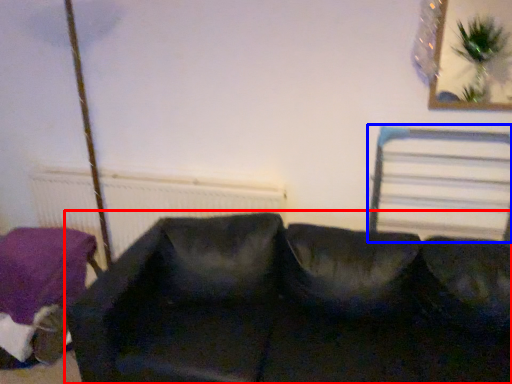
Question: Which object appears closest to the camera in this image, studio couch (highlighted by a red box) or bed frame (highlighted by a blue box)?

Choices:
 (A) studio couch
 (B) bed frame

Answer: (A)